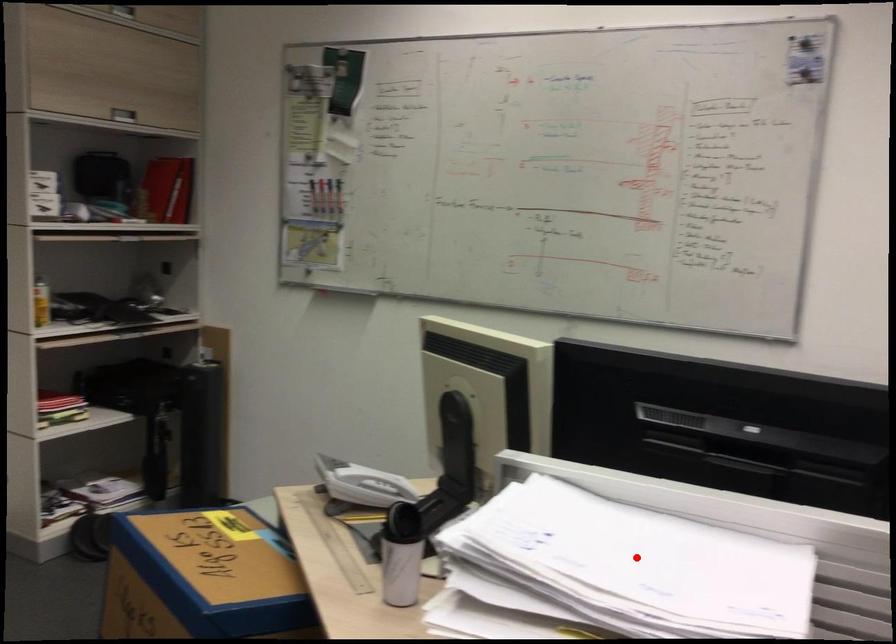
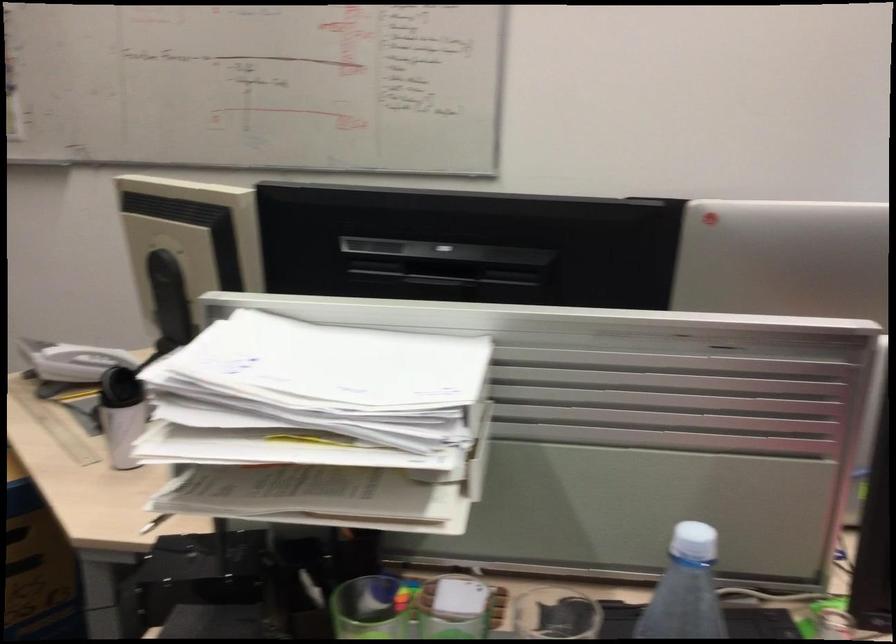
Question: I am providing you with two images of the same scene from different viewpoints. A red point is shown in image1. For the corresponding object point in image2, is it positioned nearer or farther from the camera?

Choices:
 (A) Nearer
 (B) Farther

Answer: (B)